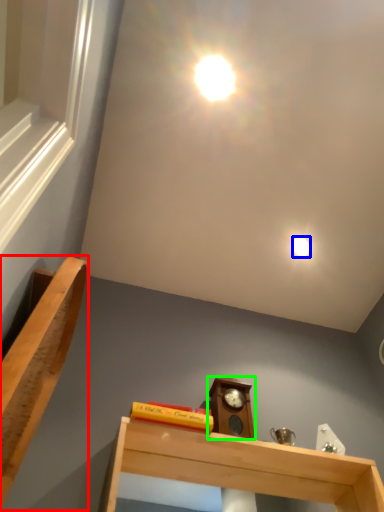
Question: Which object is the farthest from furniture (highlighted by a red box)? Choose among these: droplight (highlighted by a blue box) or alarm clock (highlighted by a green box).

Choices:
 (A) droplight
 (B) alarm clock

Answer: (A)